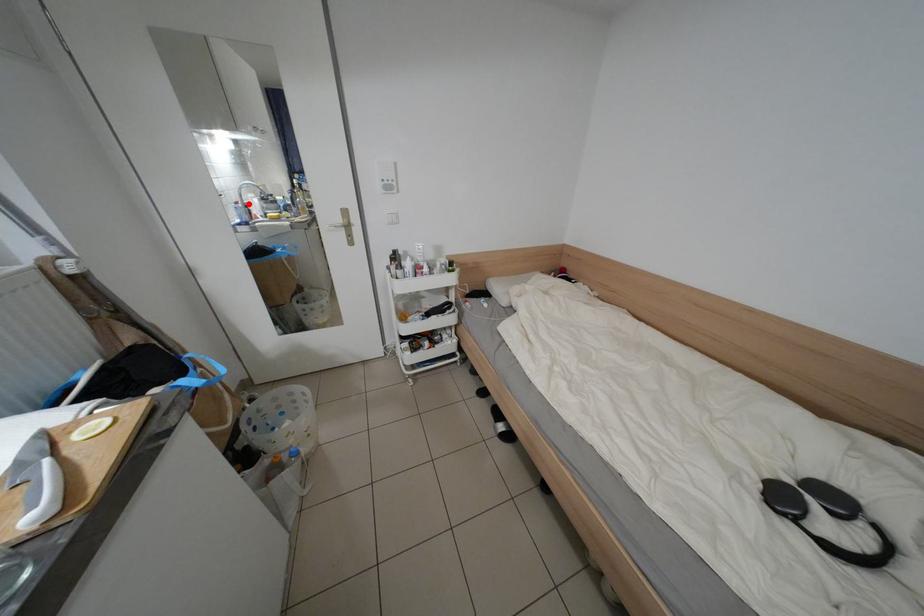
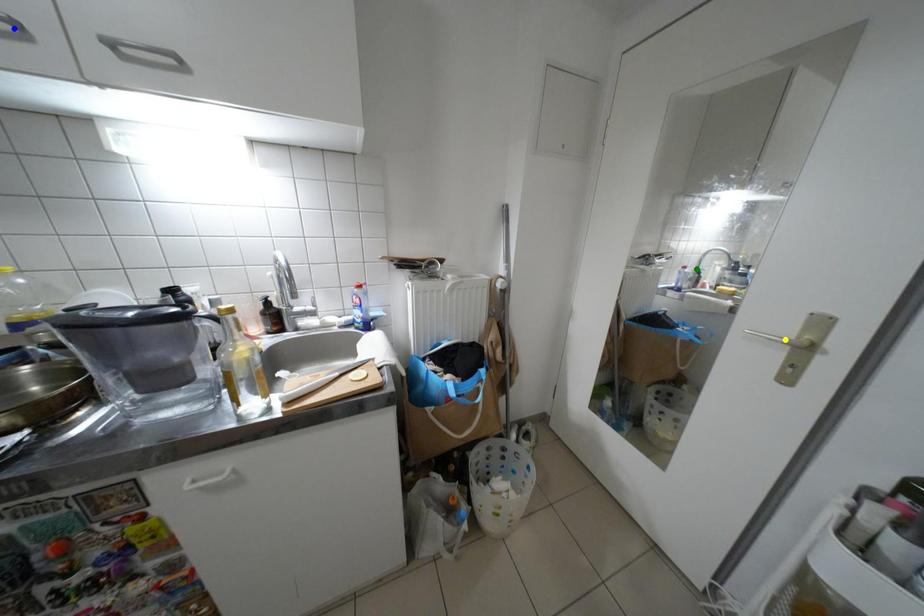
Question: I am providing you with two images of the same scene from different viewpoints. A red point is marked on the first image. You are given multiple points on the second image. In image 2, which mark is for the same physical point as the one in image 1?

Choices:
 (A) yellow point
 (B) blue point
 (C) green point

Answer: (C)